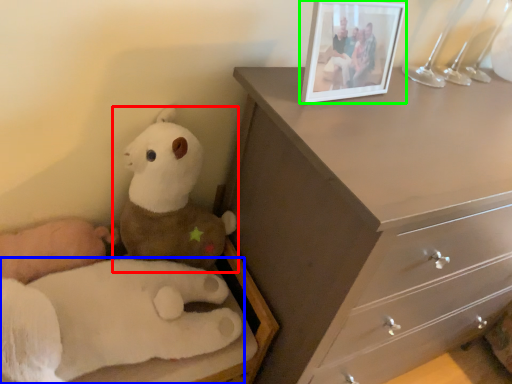
Question: Which object is the farthest from toy (highlighted by a red box)? Choose among these: toy (highlighted by a blue box) or picture frame (highlighted by a green box).

Choices:
 (A) toy
 (B) picture frame

Answer: (B)